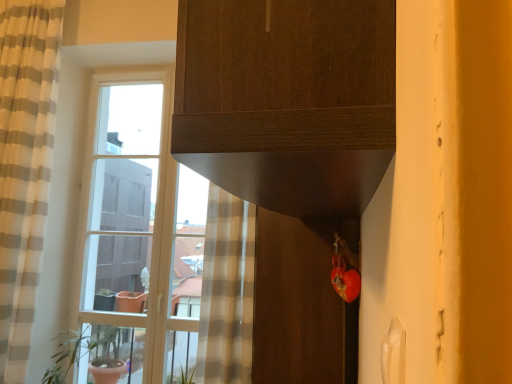
Question: From the image's perspective, is green matte plant pot at left located above matte brown screen door at lower center?

Choices:
 (A) no
 (B) yes

Answer: (A)

Question: Is green matte plant pot at left positioned in front of matte brown screen door at lower center?

Choices:
 (A) no
 (B) yes

Answer: (A)

Question: From a real-world perspective, is green matte plant pot at left located higher than matte brown screen door at lower center?

Choices:
 (A) no
 (B) yes

Answer: (A)

Question: Can you confirm if green matte plant pot at left is wider than matte brown screen door at lower center?

Choices:
 (A) no
 (B) yes

Answer: (B)

Question: Is green matte plant pot at left surrounding matte brown screen door at lower center?

Choices:
 (A) yes
 (B) no

Answer: (B)

Question: Relative to clear glass window at left, is matte brown screen door at lower center in front or behind?

Choices:
 (A) behind
 (B) front

Answer: (B)

Question: In terms of width, does matte brown screen door at lower center look wider or thinner when compared to clear glass window at left?

Choices:
 (A) thin
 (B) wide

Answer: (B)

Question: In terms of height, does matte brown screen door at lower center look taller or shorter compared to clear glass window at left?

Choices:
 (A) short
 (B) tall

Answer: (A)

Question: Is point (268, 291) positioned closer to the camera than point (110, 291)?

Choices:
 (A) farther
 (B) closer

Answer: (B)

Question: From a real-world perspective, is beige striped curtain at left physically located above or below matte brown screen door at lower center?

Choices:
 (A) below
 (B) above

Answer: (B)

Question: Would you say beige striped curtain at left is inside or outside matte brown screen door at lower center?

Choices:
 (A) outside
 (B) inside

Answer: (A)

Question: Considering the positions of beige striped curtain at left and matte brown screen door at lower center in the image, is beige striped curtain at left bigger or smaller than matte brown screen door at lower center?

Choices:
 (A) big
 (B) small

Answer: (A)

Question: Is point (27, 21) closer or farther from the camera than point (263, 289)?

Choices:
 (A) closer
 (B) farther

Answer: (B)

Question: From the image's perspective, is green matte plant pot at left above or below beige striped curtain at left?

Choices:
 (A) above
 (B) below

Answer: (B)

Question: Is green matte plant pot at left to the left or to the right of beige striped curtain at left in the image?

Choices:
 (A) right
 (B) left

Answer: (A)